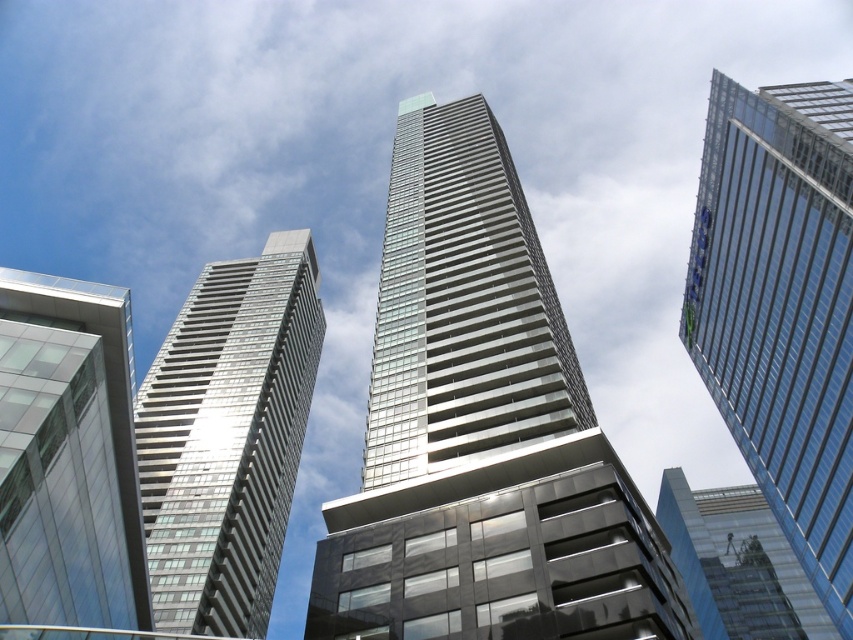
You are standing at the center of the image and looking up. Which direction should you turn to face the transparent glass building at lower left?

You should turn to your left to face the transparent glass building at lower left because it is located at the lower left direction from your current position.

You are standing on the ground floor of the clear glass skyscraper at upper right and want to look across to the transparent glass skyscraper at upper right. Which building is higher?

The clear glass skyscraper at upper right is positioned over the transparent glass skyscraper at upper right, so it is higher.

You are standing at the point marked by the coordinate point at point [68,456]. Looking up, you see the transparent glass building at lower left. Can you tell me which direction the transparent glass building at lower left is located relative to your position?

The point at point [68,456] is on the transparent glass building at lower left, so the transparent glass building at lower left is directly below your current position.